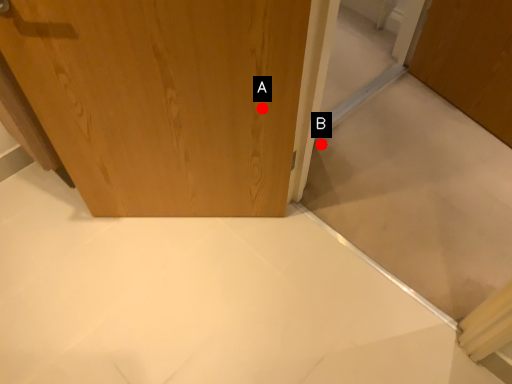
Question: Two points are circled on the image, labeled by A and B beside each circle. Which point is farther to the camera?

Choices:
 (A) A is further
 (B) B is further

Answer: (B)